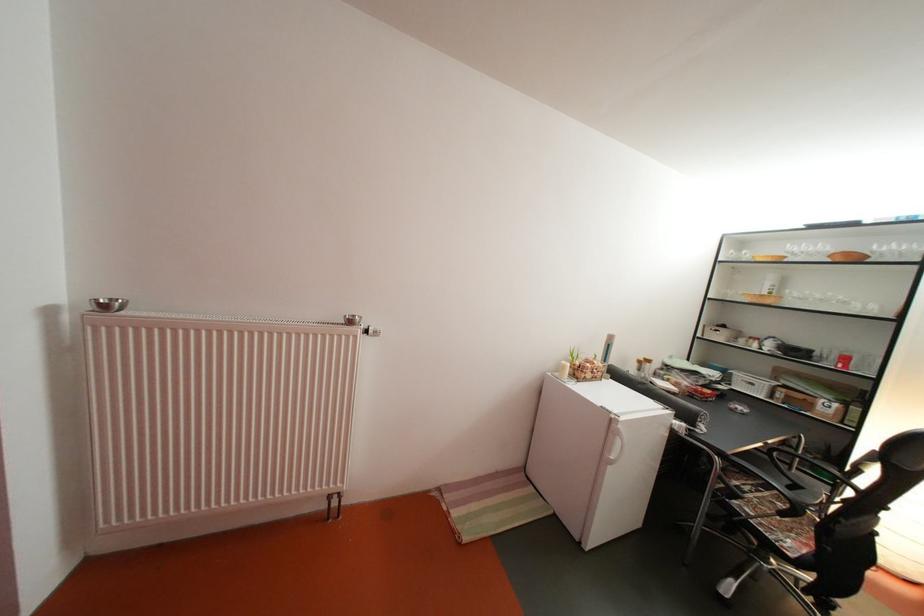
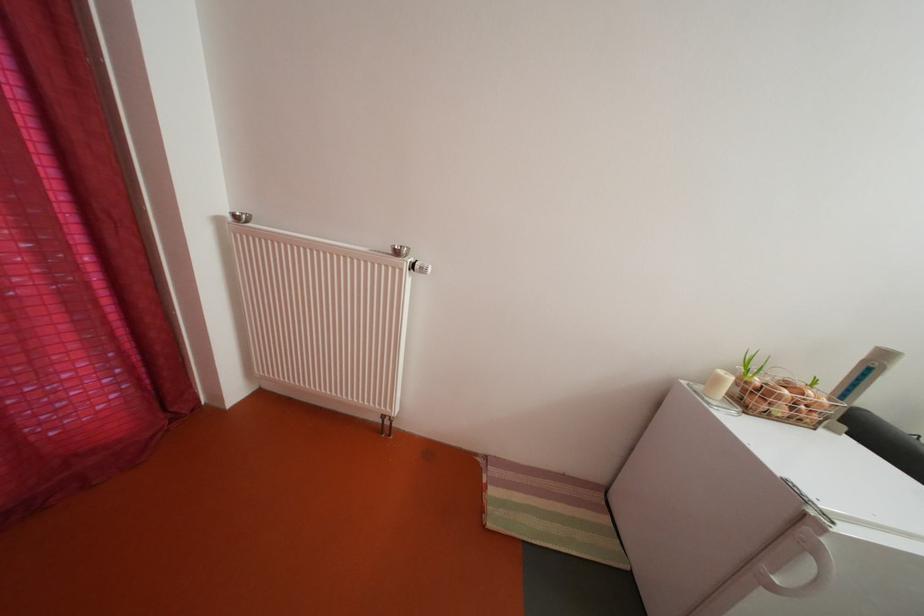
The point at [575,373] is marked in the first image. Where is the corresponding point in the second image?

(728, 386)